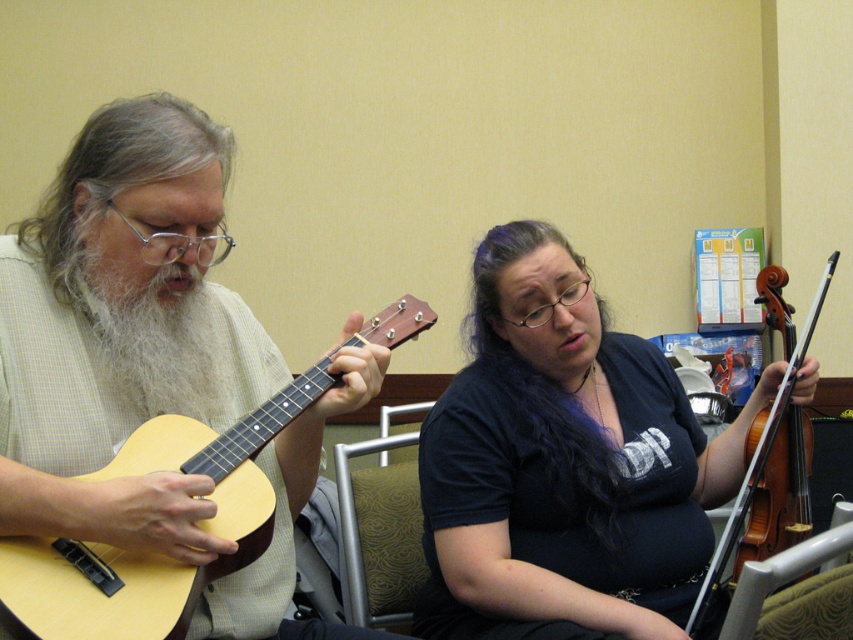
Question: Is purple silky hair at center bigger than green fabric chair at center?

Choices:
 (A) yes
 (B) no

Answer: (B)

Question: Which point is closer to the camera taking this photo?

Choices:
 (A) (189, 276)
 (B) (372, 602)

Answer: (A)

Question: Which point is farther to the camera?

Choices:
 (A) white fuzzy beard at left
 (B) matte black shirt at center
 (C) grayhair at left
 (D) wooden violin at right

Answer: (D)

Question: Is light wood acoustic guitar at left above grayhair at left?

Choices:
 (A) no
 (B) yes

Answer: (A)

Question: Where is green fabric chair at center located in relation to wooden violin at right in the image?

Choices:
 (A) above
 (B) below

Answer: (B)

Question: Which point is closer to the camera taking this photo?

Choices:
 (A) (409, 440)
 (B) (543, 572)

Answer: (B)